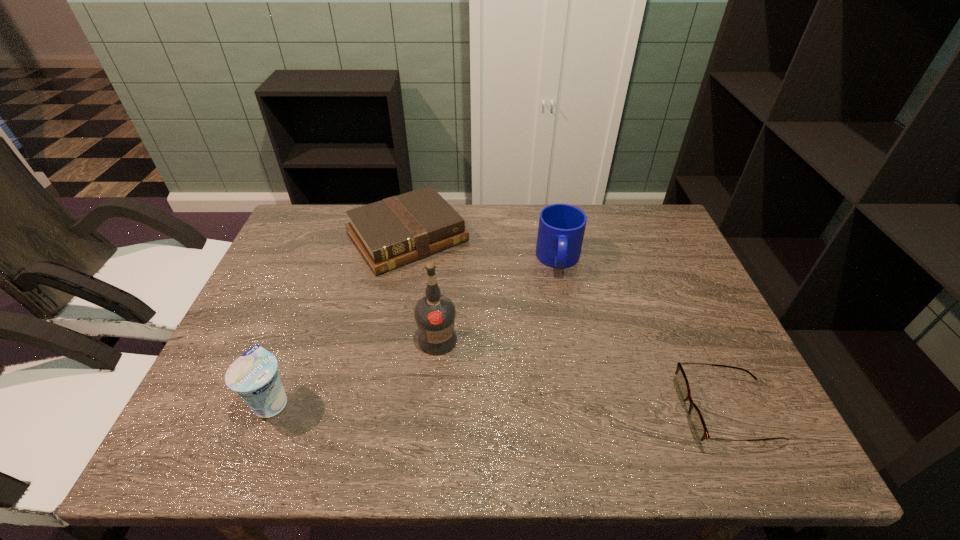
What are the coordinates of `free spot on the desktop that is between the yogurt and the spectacles and is positioned on the spine side of the second shortest object` in the screenshot? It's located at (548, 408).

Find the location of `vacant spot on the desktop that is between the yogurt and the shortest object and is positioned on the side with the handle of the second object from right to left`. vacant spot on the desktop that is between the yogurt and the shortest object and is positioned on the side with the handle of the second object from right to left is located at coordinates (562, 408).

The width and height of the screenshot is (960, 540). What are the coordinates of `vacant space on the desktop that is between the yogurt and the shortest object and is positioned on the front label of the tallest object` in the screenshot? It's located at (512, 407).